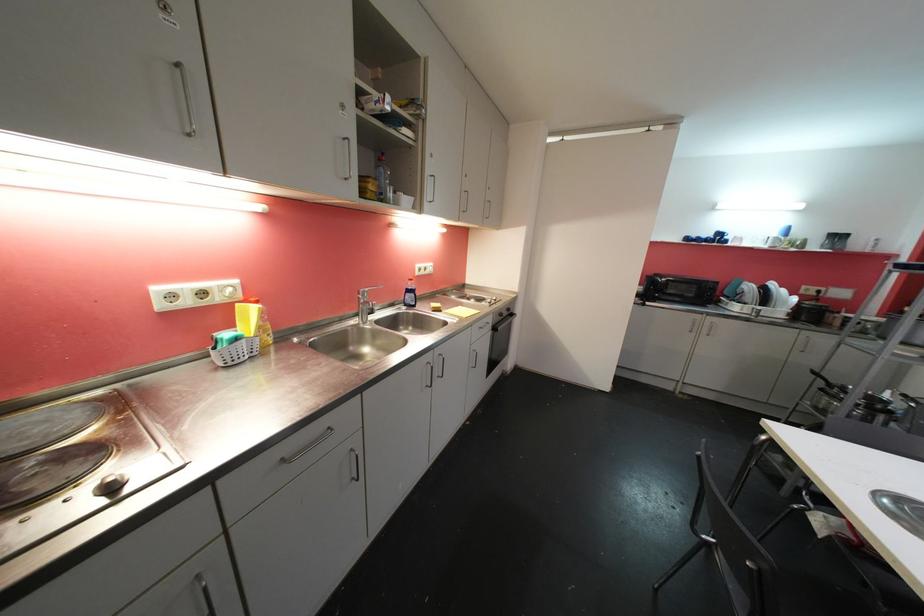
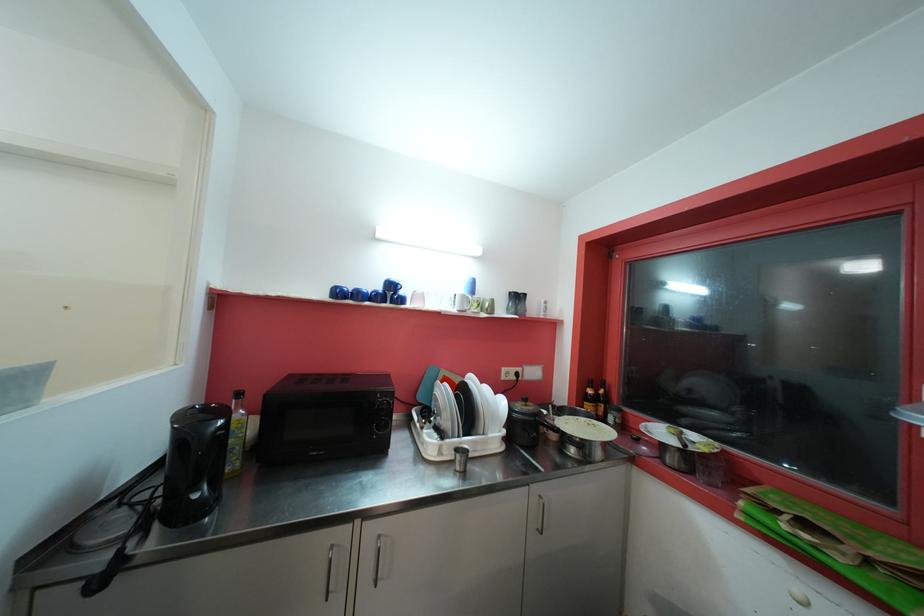
Locate, in the second image, the point that corresponds to (808,339) in the first image.

(540, 501)